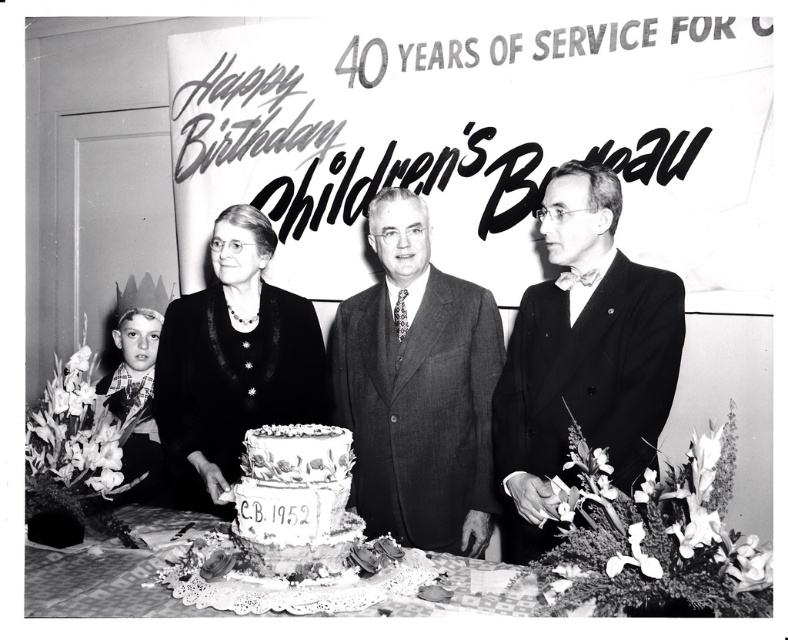
Which is above, smooth black suit at right or white lace tablecloth at center?

smooth black suit at right

The height and width of the screenshot is (640, 788). What do you see at coordinates (582, 356) in the screenshot?
I see `smooth black suit at right` at bounding box center [582, 356].

Where is `smooth black suit at right`? This screenshot has width=788, height=640. smooth black suit at right is located at coordinates (582, 356).

You are a GUI agent. You are given a task and a screenshot of the screen. Output one action in this format:
    pyautogui.click(x=<x>, y=<y>)
    Task: Click on the smooth black suit at center
    The image size is (788, 640).
    Given the screenshot: What is the action you would take?
    pyautogui.click(x=417, y=388)

Measure the distance from smooth black suit at center to white frosted cake at center.

They are 27.33 inches apart.

Which is behind, point (432, 484) or point (240, 506)?

Point (432, 484)

Identify the location of smooth black suit at center. This screenshot has height=640, width=788. (417, 388).

Does point (106, 548) come in front of point (325, 497)?

No, (106, 548) is behind (325, 497).

Is white lace tablecloth at center thinner than white frosted cake at center?

Incorrect, white lace tablecloth at center's width is not less than white frosted cake at center's.

Describe the element at coordinates (99, 582) in the screenshot. I see `white lace tablecloth at center` at that location.

Find the location of `white lace tablecloth at center`. white lace tablecloth at center is located at coordinates (99, 582).